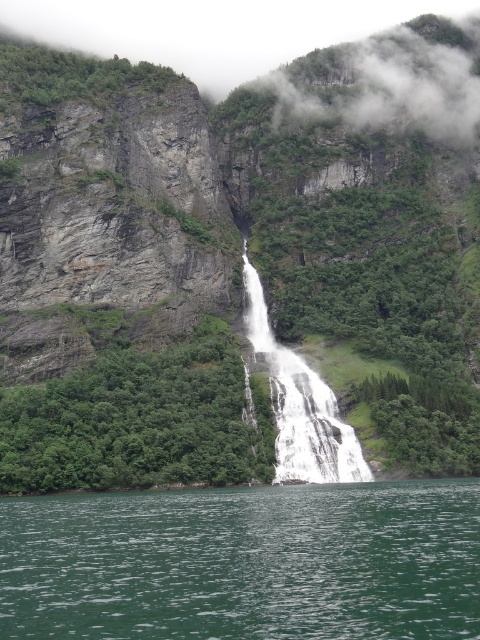
In the scene shown: You are standing at the edge of the waterfall cliff and see the point marked at coordinates (244,563). Based on the scene description, what is the color of the liquid at that point?

The point at (244,563) indicates green liquid water at center, so the color is green.

You are standing at the edge of the cliff overlooking the scene. You need to determine the direction of the water flow. Which object is above the other? The green liquid water at center or the white smooth waterfall at center?

The white smooth waterfall at center is above the green liquid water at center because the waterfall flows downward into the water below.